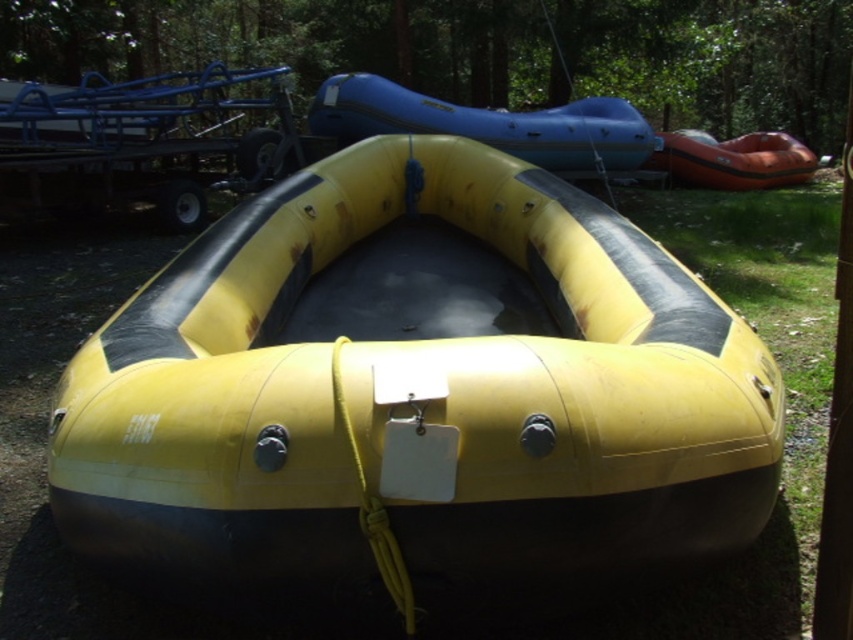
Is yellow rubber boat at center taller than orange rubber raft at upper right?

Correct, yellow rubber boat at center is much taller as orange rubber raft at upper right.

Which is in front, point (331, 342) or point (767, 184)?

Point (331, 342) is in front.

Locate an element on the screen. The width and height of the screenshot is (853, 640). yellow rubber boat at center is located at coordinates (416, 387).

Who is positioned more to the left, rubberized blue raft at upper center or orange rubber raft at upper right?

From the viewer's perspective, rubberized blue raft at upper center appears more on the left side.

Is rubberized blue raft at upper center to the left of orange rubber raft at upper right from the viewer's perspective?

Yes, rubberized blue raft at upper center is to the left of orange rubber raft at upper right.

The height and width of the screenshot is (640, 853). What are the coordinates of `rubberized blue raft at upper center` in the screenshot? It's located at (486, 124).

Does yellow rubber boat at center have a lesser height compared to rubberized blue raft at upper center?

No.

Between point (512, 504) and point (387, 116), which one is positioned in front?

Point (512, 504)

You are a GUI agent. You are given a task and a screenshot of the screen. Output one action in this format:
    pyautogui.click(x=<x>, y=<y>)
    Task: Click on the yellow rubber boat at center
    The image size is (853, 640).
    Given the screenshot: What is the action you would take?
    pyautogui.click(x=416, y=387)